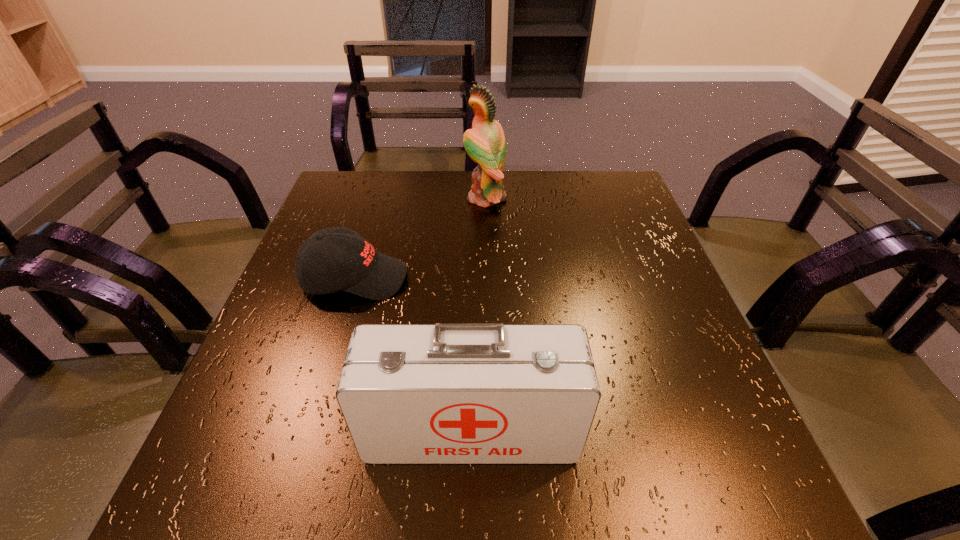
In order to click on vacant point that satisfies the following two spatial constraints: 1. on the front-facing side of the tallest object; 2. on the front-facing side of the nearest object in this screenshot , I will do `click(490, 431)`.

The height and width of the screenshot is (540, 960). What are the coordinates of `free space in the image that satisfies the following two spatial constraints: 1. on the front-facing side of the tallest object; 2. on the front-facing side of the nearest object` in the screenshot? It's located at (490, 431).

Locate an element on the screen. free point that satisfies the following two spatial constraints: 1. on the front-facing side of the tallest object; 2. on the front-facing side of the nearest object is located at coordinates (490, 431).